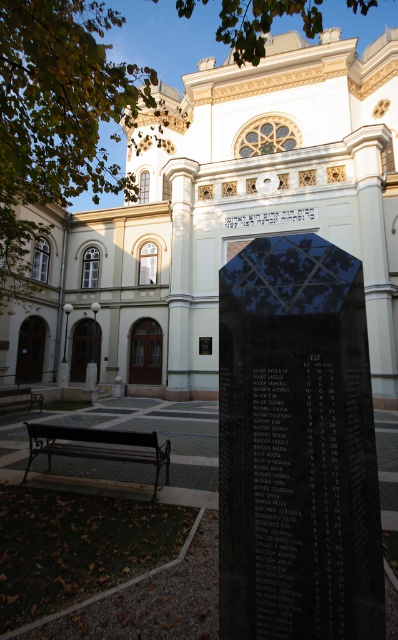
Question: Which of these objects is positioned farthest from the black polished stone monument at center?

Choices:
 (A) black metal bench at lower left
 (B) brown wooden bench at lower left

Answer: (B)

Question: Among these points, which one is farthest from the camera?

Choices:
 (A) 7,406
 (B) 120,445
 (C) 378,198

Answer: (C)

Question: Which of the following is the farthest from the observer?

Choices:
 (A) black polished stone monument at center
 (B) black metal bench at lower left

Answer: (B)

Question: Can you confirm if white stone church at center is wider than black metal bench at lower left?

Choices:
 (A) yes
 (B) no

Answer: (A)

Question: Is black polished stone monument at center in front of brown wooden bench at lower left?

Choices:
 (A) yes
 (B) no

Answer: (A)

Question: Does black polished stone monument at center have a greater width compared to black metal bench at lower left?

Choices:
 (A) yes
 (B) no

Answer: (B)